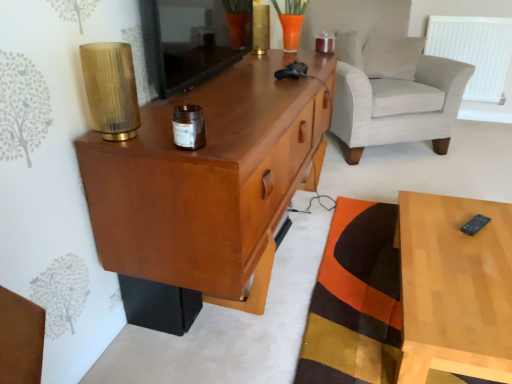
Identify the location of vacant space underneath smooth wooden mirror at upper center (from a real-world perspective). (217, 72).